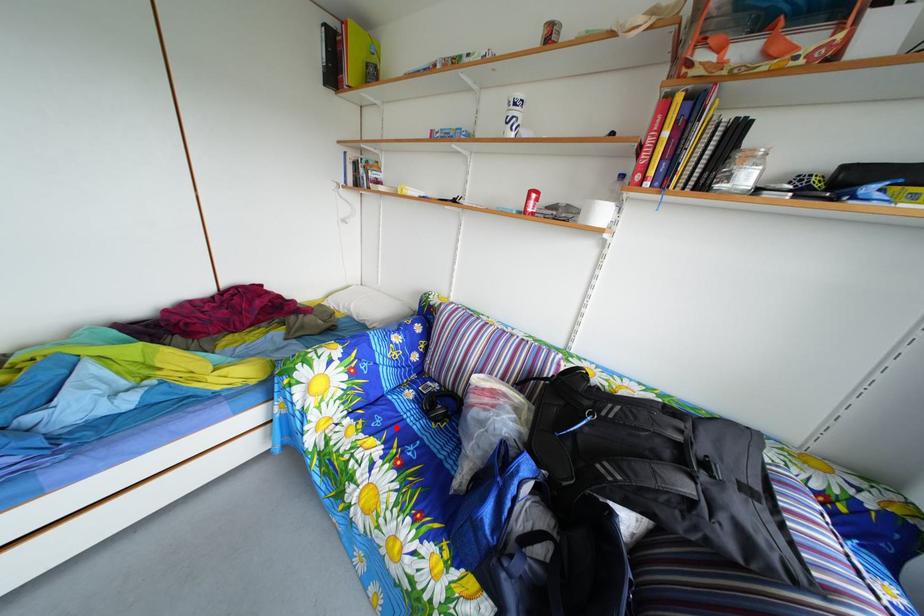
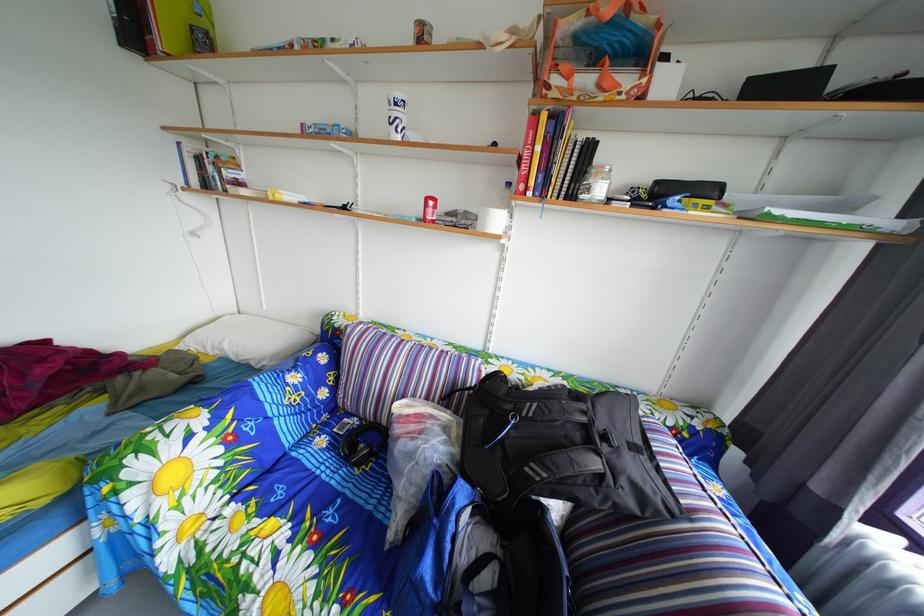
Question: I am providing you with two images of the same scene from different viewpoints. A red point is marked on the first image. Can you still see the location of the red point in image 2?

Choices:
 (A) Yes
 (B) No

Answer: (A)